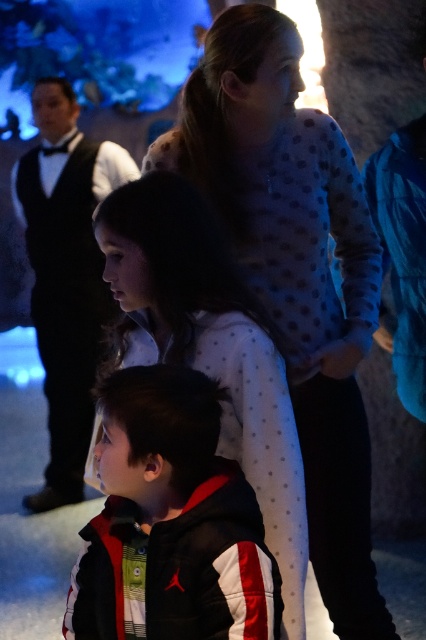
Image resolution: width=426 pixels, height=640 pixels. In order to click on white dotted sweater at upper center in this screenshot , I will do `click(296, 273)`.

Does white dotted sweater at upper center have a smaller size compared to white dotted shirt at upper center?

Incorrect, white dotted sweater at upper center is not smaller in size than white dotted shirt at upper center.

The height and width of the screenshot is (640, 426). What do you see at coordinates (296, 273) in the screenshot?
I see `white dotted sweater at upper center` at bounding box center [296, 273].

Image resolution: width=426 pixels, height=640 pixels. In order to click on white dotted sweater at upper center in this screenshot , I will do `click(296, 273)`.

From the picture: Which is above, black and white jacket at lower center or white dotted shirt at upper center?

Positioned higher is white dotted shirt at upper center.

Between point (230, 627) and point (131, 205), which one is positioned in front?

Positioned in front is point (230, 627).

I want to click on black and white jacket at lower center, so click(172, 520).

Does white dotted sweater at upper center appear over black and white jacket at lower center?

Yes.

Is white dotted sweater at upper center taller than black and white jacket at lower center?

Correct, white dotted sweater at upper center is much taller as black and white jacket at lower center.

Between point (307, 400) and point (166, 636), which one is positioned behind?

The point (307, 400) is behind.

You are a GUI agent. You are given a task and a screenshot of the screen. Output one action in this format:
    pyautogui.click(x=<x>, y=<y>)
    Task: Click on the white dotted sweater at upper center
    
    Given the screenshot: What is the action you would take?
    pyautogui.click(x=296, y=273)